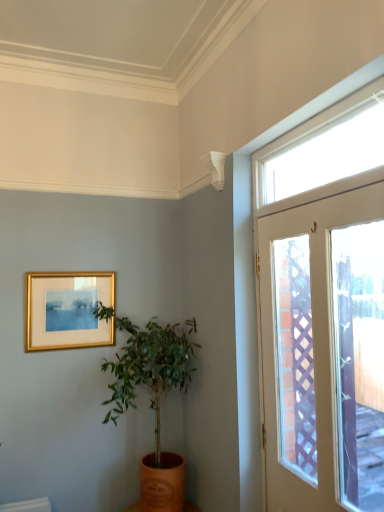
Question: Does white glossy door at right have a lesser width compared to clear glass window at upper right?

Choices:
 (A) yes
 (B) no

Answer: (A)

Question: Considering the relative positions of white glossy door at right and clear glass window at upper right in the image provided, is white glossy door at right to the left of clear glass window at upper right from the viewer's perspective?

Choices:
 (A) no
 (B) yes

Answer: (A)

Question: Is white glossy door at right not near clear glass window at upper right?

Choices:
 (A) no
 (B) yes

Answer: (A)

Question: Is the depth of white glossy door at right greater than that of clear glass window at upper right?

Choices:
 (A) yes
 (B) no

Answer: (B)

Question: From a real-world perspective, is white glossy door at right positioned under clear glass window at upper right based on gravity?

Choices:
 (A) yes
 (B) no

Answer: (A)

Question: Considering the relative sizes of white glossy door at right and clear glass window at upper right in the image provided, is white glossy door at right smaller than clear glass window at upper right?

Choices:
 (A) no
 (B) yes

Answer: (A)

Question: From the image's perspective, is clear glass window at upper right beneath orange clay pot at center?

Choices:
 (A) yes
 (B) no

Answer: (B)

Question: From a real-world perspective, is clear glass window at upper right physically above orange clay pot at center?

Choices:
 (A) yes
 (B) no

Answer: (A)

Question: From the image's perspective, does clear glass window at upper right appear higher than orange clay pot at center?

Choices:
 (A) no
 (B) yes

Answer: (B)

Question: From a real-world perspective, is clear glass window at upper right below orange clay pot at center?

Choices:
 (A) yes
 (B) no

Answer: (B)

Question: Is clear glass window at upper right not close to orange clay pot at center?

Choices:
 (A) no
 (B) yes

Answer: (B)

Question: Is orange clay pot at center completely or partially inside clear glass window at upper right?

Choices:
 (A) yes
 (B) no

Answer: (B)

Question: Can you confirm if gold metallic picture frame at upper left is smaller than clear glass window at upper right?

Choices:
 (A) no
 (B) yes

Answer: (B)